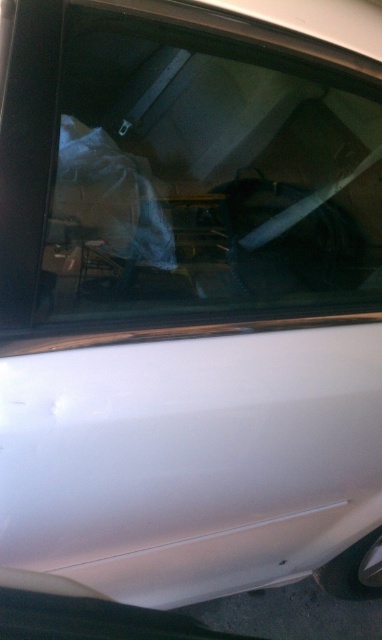
Based on the photo, which of these two, transparent plastic bag at upper center or white glossy car door at lower left, stands shorter?

transparent plastic bag at upper center is shorter.

Between point (108, 60) and point (220, 445), which one is positioned in front?

Positioned in front is point (108, 60).

In order to click on transparent plastic bag at upper center in this screenshot , I will do `click(205, 173)`.